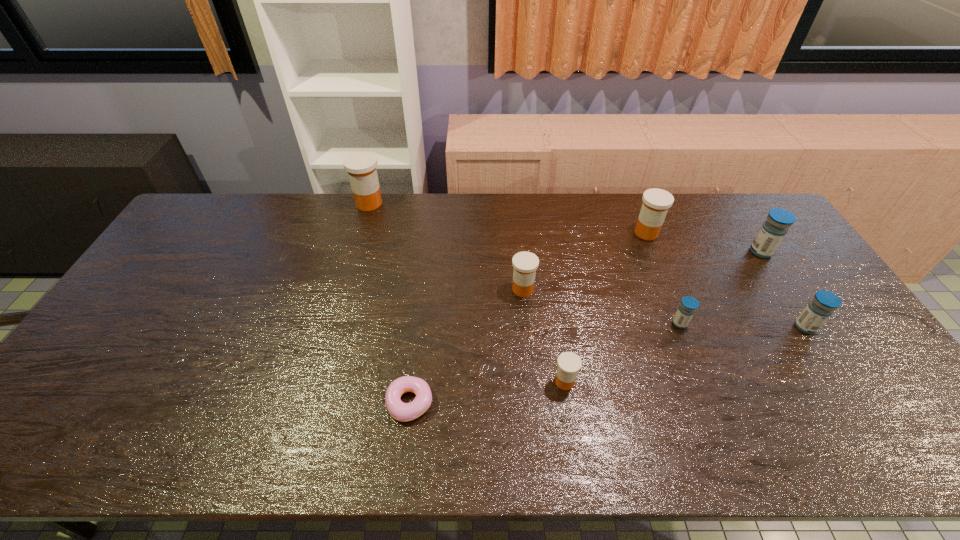
Locate an element on the screen. free space at the right edge of the desktop is located at coordinates (778, 260).

At what (x,y) coordinates should I click in order to perform the action: click on free space at the near left corner. Please return your answer as a coordinate pair (x, y). The height and width of the screenshot is (540, 960). Looking at the image, I should click on (89, 456).

Where is `vacant space at the far right corner of the desktop`? This screenshot has width=960, height=540. vacant space at the far right corner of the desktop is located at coordinates (756, 220).

Identify the location of unoccupied position between the shortest object and the leftmost medicine. Image resolution: width=960 pixels, height=540 pixels. (390, 303).

Locate an element on the screen. The height and width of the screenshot is (540, 960). vacant point located between the fourth farthest medicine and the second smallest blue medicine is located at coordinates (664, 308).

Identify the location of unoccupied position between the third smallest orange medicine and the leftmost blue medicine. The width and height of the screenshot is (960, 540). (663, 278).

At what (x,y) coordinates should I click in order to perform the action: click on vacant area that lies between the second object from left to right and the third farthest orange medicine. Please return your answer as a coordinate pair (x, y). The image size is (960, 540). Looking at the image, I should click on (467, 346).

The height and width of the screenshot is (540, 960). Identify the location of free space between the third object from left to right and the biggest blue medicine. [642, 271].

You are a GUI agent. You are given a task and a screenshot of the screen. Output one action in this format:
    pyautogui.click(x=<x>, y=<y>)
    Task: Click on the vacant region between the doughnut and the third smallest orange medicine
    The width and height of the screenshot is (960, 540).
    Given the screenshot: What is the action you would take?
    pyautogui.click(x=528, y=318)

Identify the location of free space between the doughnut and the second biggest blue medicine. (608, 365).